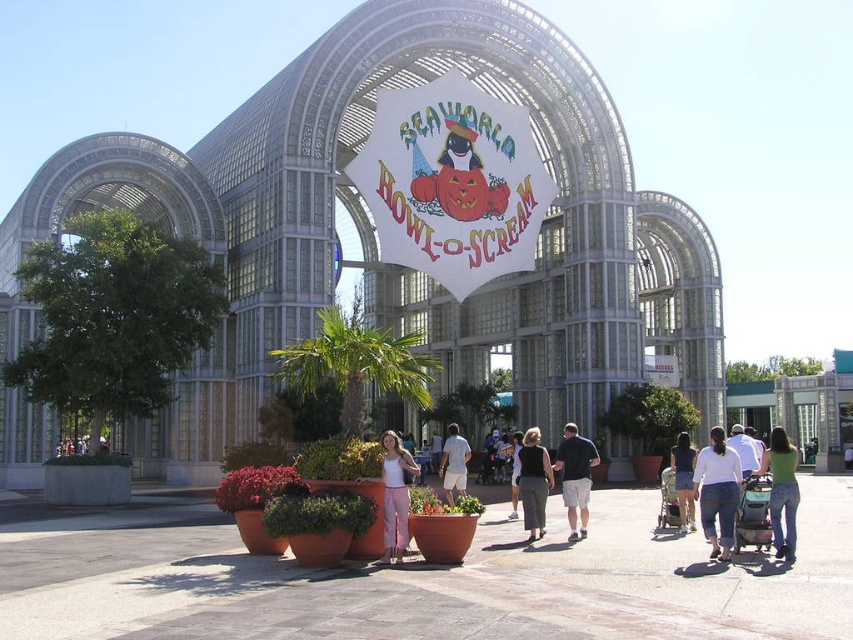
Which is more to the right, dark blue shirt at center or denim shorts at lower right?

denim shorts at lower right

Does dark blue shirt at center have a lesser height compared to denim shorts at lower right?

No.

Is point (572, 509) farther from camera compared to point (686, 474)?

No, (572, 509) is closer to viewer.

Where is `dark blue shirt at center`? dark blue shirt at center is located at coordinates (575, 477).

Is white glass building at center wider than white cotton shirt at center?

Correct, the width of white glass building at center exceeds that of white cotton shirt at center.

This screenshot has width=853, height=640. Describe the element at coordinates (376, 240) in the screenshot. I see `white glass building at center` at that location.

The width and height of the screenshot is (853, 640). What do you see at coordinates (376, 240) in the screenshot?
I see `white glass building at center` at bounding box center [376, 240].

You are a GUI agent. You are given a task and a screenshot of the screen. Output one action in this format:
    pyautogui.click(x=<x>, y=<y>)
    Task: Click on the white glass building at center
    
    Given the screenshot: What is the action you would take?
    pyautogui.click(x=376, y=240)

Between white cotton shirt at lower right and matte white tank top at center, which one is positioned lower?

matte white tank top at center

Describe the element at coordinates (717, 492) in the screenshot. I see `white cotton shirt at lower right` at that location.

Where is `white cotton shirt at lower right`? white cotton shirt at lower right is located at coordinates (717, 492).